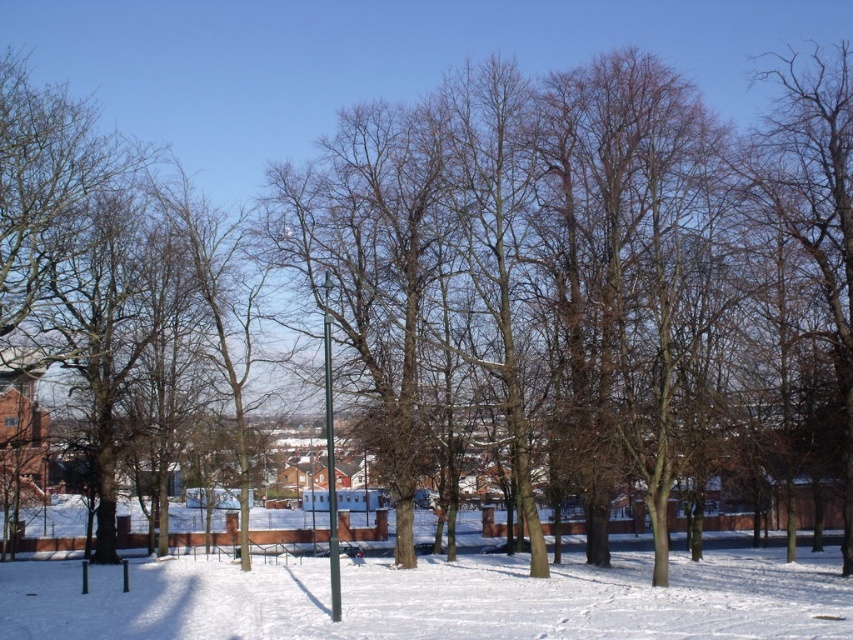
Question: Does white powdery snow at center appear on the left side of metallic pole at center?

Choices:
 (A) yes
 (B) no

Answer: (B)

Question: Can you confirm if white powdery snow at center is wider than metallic pole at center?

Choices:
 (A) yes
 (B) no

Answer: (A)

Question: In this image, where is white powdery snow at center located relative to metallic pole at center?

Choices:
 (A) right
 (B) left

Answer: (A)

Question: Which object appears farthest from the camera in this image?

Choices:
 (A) white powdery snow at center
 (B) metallic pole at center

Answer: (B)